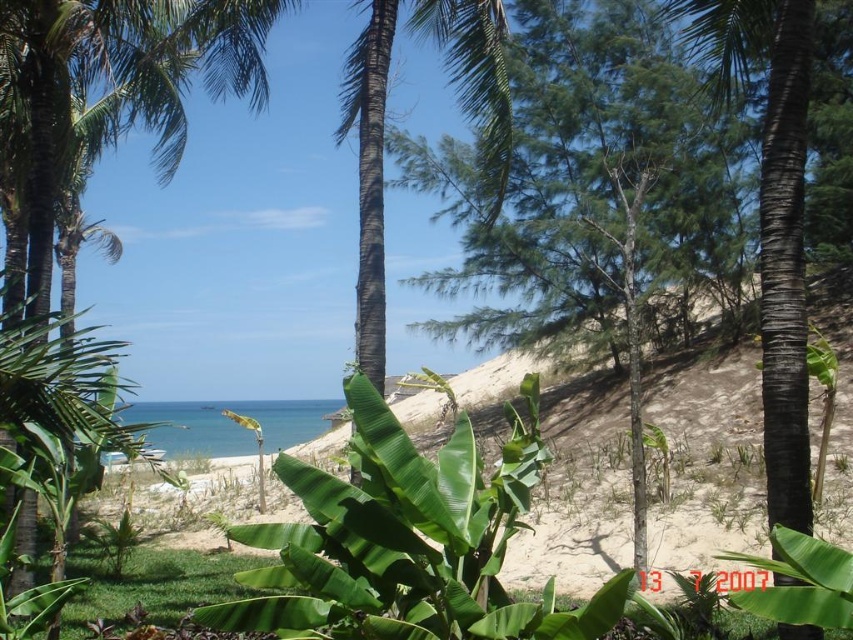
Which of these two, green leafy palm tree at left or black textured palm tree at center, stands taller?

With more height is black textured palm tree at center.

Does point (155, 83) come behind point (717, 58)?

Yes, it is.

The image size is (853, 640). Identify the location of green leafy palm tree at left. (119, 81).